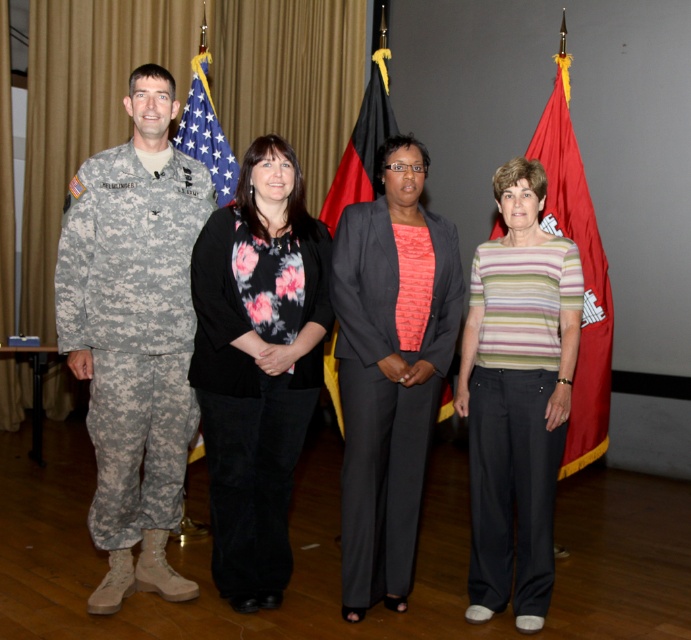
Question: Which object appears farthest from the camera in this image?

Choices:
 (A) black matte floral blouse at center
 (B) black fabric flag at center
 (C) striped cotton shirt at center

Answer: (B)

Question: Which object appears closest to the camera in this image?

Choices:
 (A) camouflage fabric uniform at left
 (B) red fabric flag at right
 (C) black fabric flag at center

Answer: (A)

Question: Does dark gray suit at center have a smaller size compared to american flag at left?

Choices:
 (A) no
 (B) yes

Answer: (A)

Question: Is striped cotton shirt at center smaller than dark gray suit at center?

Choices:
 (A) no
 (B) yes

Answer: (A)

Question: Does dark gray suit at center lie behind black fabric flag at center?

Choices:
 (A) yes
 (B) no

Answer: (B)

Question: Which object appears farthest from the camera in this image?

Choices:
 (A) black fabric flag at center
 (B) dark gray suit at center

Answer: (A)